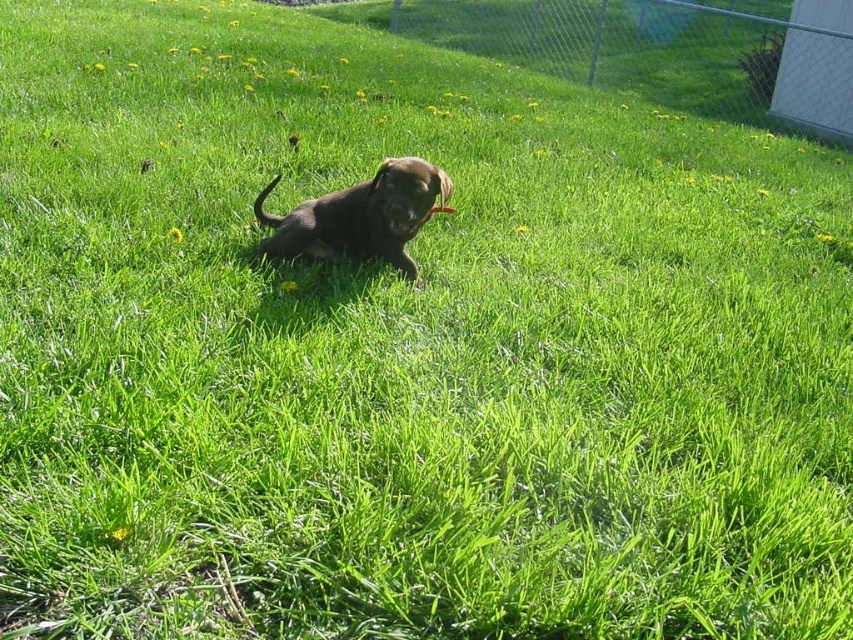
Question: Among these objects, which one is nearest to the camera?

Choices:
 (A) shiny brown puppy at center
 (B) metallic chain-link fence at upper right

Answer: (A)

Question: Does metallic chain-link fence at upper right appear over shiny brown puppy at center?

Choices:
 (A) no
 (B) yes

Answer: (B)

Question: Which point is closer to the camera?

Choices:
 (A) metallic chain-link fence at upper right
 (B) shiny brown puppy at center

Answer: (B)

Question: Which object appears closest to the camera in this image?

Choices:
 (A) shiny brown puppy at center
 (B) metallic chain-link fence at upper right

Answer: (A)

Question: Can you confirm if metallic chain-link fence at upper right is bigger than shiny brown puppy at center?

Choices:
 (A) no
 (B) yes

Answer: (B)

Question: Can you confirm if metallic chain-link fence at upper right is smaller than shiny brown puppy at center?

Choices:
 (A) yes
 (B) no

Answer: (B)